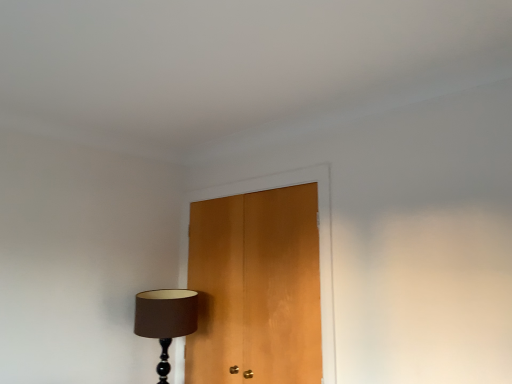
You are a GUI agent. You are given a task and a screenshot of the screen. Output one action in this format:
    pyautogui.click(x=<x>, y=<y>)
    Task: Click on the matte brown lampshade at lower left
    The image size is (512, 384).
    Given the screenshot: What is the action you would take?
    pyautogui.click(x=165, y=319)

In order to face matte brown lampshade at lower left, should I rotate leftwards or rightwards?

Turn left by 11.883 degrees to look at matte brown lampshade at lower left.

Describe the element at coordinates (165, 319) in the screenshot. This screenshot has width=512, height=384. I see `matte brown lampshade at lower left` at that location.

Consider the image. Measure the distance between point (270, 279) and camera.

Point (270, 279) is 2.22 meters from camera.

This screenshot has width=512, height=384. What do you see at coordinates (255, 287) in the screenshot? I see `wooden door at center` at bounding box center [255, 287].

Where is `wooden door at center`? Image resolution: width=512 pixels, height=384 pixels. wooden door at center is located at coordinates (255, 287).

Where is `matte brown lampshade at lower left`? Image resolution: width=512 pixels, height=384 pixels. matte brown lampshade at lower left is located at coordinates (165, 319).

Would you say matte brown lampshade at lower left is to the left or to the right of wooden door at center in the picture?

matte brown lampshade at lower left is positioned on wooden door at center's left side.

Which object is closer to the camera, matte brown lampshade at lower left or wooden door at center?

wooden door at center is more forward.

Between point (160, 290) and point (234, 204), which one is positioned in front?

The point (234, 204) is more forward.

In the scene shown: From the image's perspective, is matte brown lampshade at lower left on top of wooden door at center?

No, from the image's perspective, matte brown lampshade at lower left is not above wooden door at center.

From a real-world perspective, is matte brown lampshade at lower left positioned under wooden door at center based on gravity?

Yes, from a real-world perspective, matte brown lampshade at lower left is below wooden door at center.

Which of these two, matte brown lampshade at lower left or wooden door at center, is thinner?

With smaller width is wooden door at center.

Who is shorter, matte brown lampshade at lower left or wooden door at center?

matte brown lampshade at lower left.

In terms of size, does matte brown lampshade at lower left appear bigger or smaller than wooden door at center?

In the image, matte brown lampshade at lower left appears to be smaller than wooden door at center.

In the scene shown: Is wooden door at center completely or partially inside matte brown lampshade at lower left?

No, wooden door at center is not inside matte brown lampshade at lower left.

Is matte brown lampshade at lower left beside wooden door at center?

There is a gap between matte brown lampshade at lower left and wooden door at center.

Looking at this image, could you tell me if matte brown lampshade at lower left is turned towards wooden door at center?

No, matte brown lampshade at lower left is not aimed at wooden door at center.

Based on the photo, measure the distance from matte brown lampshade at lower left to wooden door at center.

41.83 centimeters.

Identify the location of door that appears above the matte brown lampshade at lower left (from the image's perspective). (255, 287).

Considering the positions of objects wooden door at center and matte brown lampshade at lower left in the image provided, who is more to the right, wooden door at center or matte brown lampshade at lower left?

From the viewer's perspective, wooden door at center appears more on the right side.

Considering the relative positions of wooden door at center and matte brown lampshade at lower left in the image provided, is wooden door at center in front of matte brown lampshade at lower left?

Yes, the depth of wooden door at center is less than that of matte brown lampshade at lower left.

Is point (201, 251) positioned before point (181, 330)?

That is False.

From the image's perspective, which is below, wooden door at center or matte brown lampshade at lower left?

matte brown lampshade at lower left is shown below in the image.

From a real-world perspective, which is physically below, wooden door at center or matte brown lampshade at lower left?

matte brown lampshade at lower left is physically lower.

Which of these two, wooden door at center or matte brown lampshade at lower left, is wider?

With larger width is matte brown lampshade at lower left.

Who is shorter, wooden door at center or matte brown lampshade at lower left?

Standing shorter between the two is matte brown lampshade at lower left.

In terms of size, does wooden door at center appear bigger or smaller than matte brown lampshade at lower left?

wooden door at center is bigger than matte brown lampshade at lower left.

Is matte brown lampshade at lower left located within wooden door at center?

No, wooden door at center does not contain matte brown lampshade at lower left.

Is wooden door at center with matte brown lampshade at lower left?

wooden door at center is not next to matte brown lampshade at lower left, and they're not touching.

Is wooden door at center turned away from matte brown lampshade at lower left?

Yes, matte brown lampshade at lower left is at the back of wooden door at center.

How distant is wooden door at center from matte brown lampshade at lower left?

wooden door at center and matte brown lampshade at lower left are 41.83 centimeters apart.

Locate an element on the screen. This screenshot has height=384, width=512. lamp below the wooden door at center (from a real-world perspective) is located at coordinates (165, 319).

This screenshot has width=512, height=384. Identify the location of door on the right of matte brown lampshade at lower left. (255, 287).

Where is `lamp located on the left of wooden door at center`? Image resolution: width=512 pixels, height=384 pixels. lamp located on the left of wooden door at center is located at coordinates (165, 319).